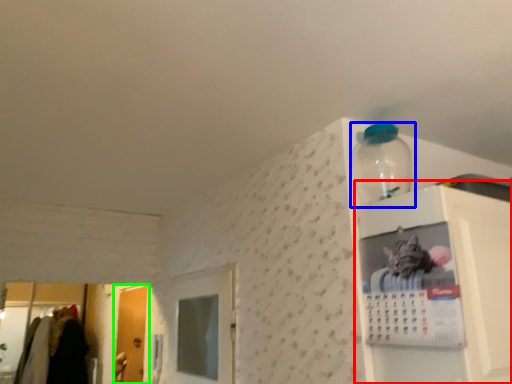
Question: Which object is positioned closest to cabinet (highlighted by a red box)? Select from bottle (highlighted by a blue box) and door (highlighted by a green box).

Choices:
 (A) bottle
 (B) door

Answer: (A)